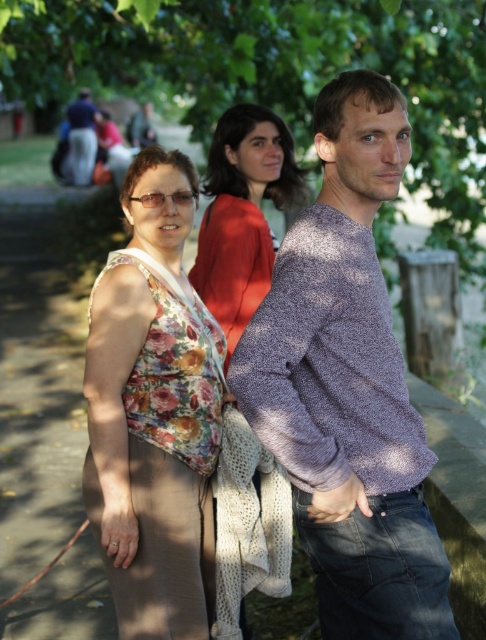
Question: Which object is the closest to the floral fabric top at center?

Choices:
 (A) purple textured sweater at center
 (B) dark blue sweater at center

Answer: (A)

Question: From the image, what is the correct spatial relationship of floral fabric blouse at center in relation to dark blue sweater at center?

Choices:
 (A) above
 (B) below

Answer: (B)

Question: Does green leafy tree at center have a larger size compared to floral fabric top at center?

Choices:
 (A) yes
 (B) no

Answer: (A)

Question: Which of the following is the farthest from the observer?

Choices:
 (A) dark blue sweater at center
 (B) floral fabric top at center

Answer: (A)

Question: Estimate the real-world distances between objects in this image. Which object is farther from the floral fabric top at center?

Choices:
 (A) dark blue sweater at center
 (B) floral fabric blouse at center
 (C) purple textured sweater at center
 (D) green leafy tree at center

Answer: (A)

Question: Is floral fabric blouse at center above dark blue sweater at center?

Choices:
 (A) yes
 (B) no

Answer: (B)